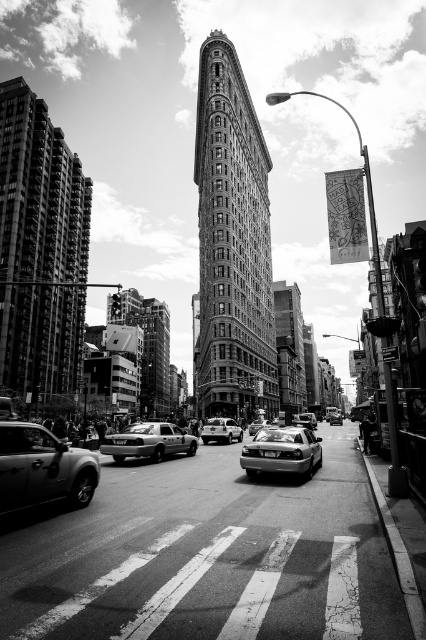
Can you confirm if silver metallic taxi at center is positioned to the right of white glossy taxi at center?

No, silver metallic taxi at center is not to the right of white glossy taxi at center.

Can you confirm if silver metallic taxi at center is thinner than white glossy taxi at center?

No, silver metallic taxi at center is not thinner than white glossy taxi at center.

Which is behind, point (141, 449) or point (204, 429)?

The point (204, 429) is behind.

At what (x,y) coordinates should I click in order to perform the action: click on silver metallic taxi at center. Please return your answer as a coordinate pair (x, y). Looking at the image, I should click on (149, 442).

Is silver metallic sedan at center wider than metallic silver sedan at center?

In fact, silver metallic sedan at center might be narrower than metallic silver sedan at center.

Which is below, silver metallic sedan at center or metallic silver sedan at center?

metallic silver sedan at center is below.

Locate an element on the screen. silver metallic sedan at center is located at coordinates (282, 451).

Locate an element on the screen. The height and width of the screenshot is (640, 426). silver metallic sedan at center is located at coordinates (282, 451).

Can you confirm if silver metallic sedan at center is smaller than silver metallic taxi at center?

Indeed, silver metallic sedan at center has a smaller size compared to silver metallic taxi at center.

Describe the element at coordinates (282, 451) in the screenshot. I see `silver metallic sedan at center` at that location.

Where is `silver metallic sedan at center`? silver metallic sedan at center is located at coordinates (282, 451).